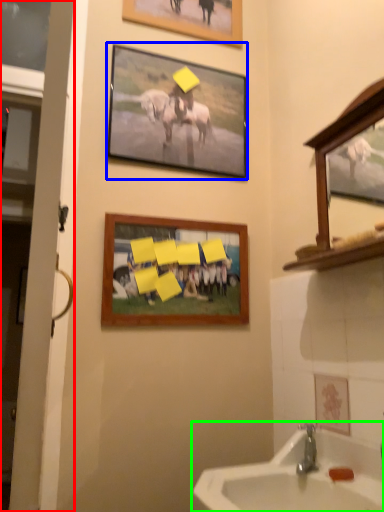
Question: Considering the real-world distances, which object is closest to door (highlighted by a red box)? picture frame (highlighted by a blue box) or sink (highlighted by a green box).

Choices:
 (A) picture frame
 (B) sink

Answer: (B)